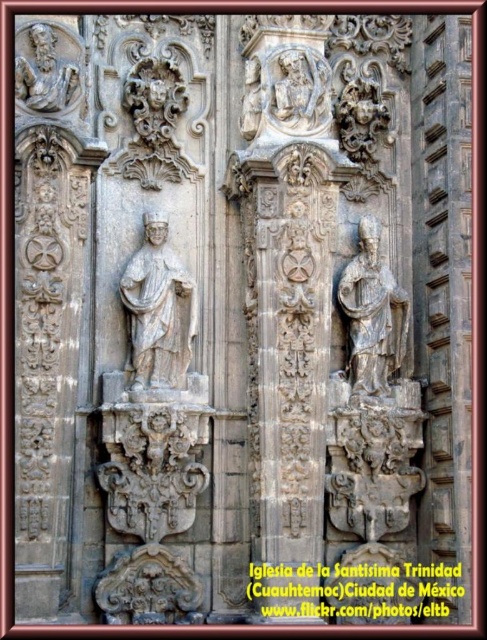
Is white stone statue at center positioned at the back of gray stone statue at center?

No.

The width and height of the screenshot is (487, 640). I want to click on white stone statue at center, so click(157, 308).

Does white stone statue at center appear over gray stone statue at upper left?

Actually, white stone statue at center is below gray stone statue at upper left.

At what (x,y) coordinates should I click in order to perform the action: click on white stone statue at center. Please return your answer as a coordinate pair (x, y). The width and height of the screenshot is (487, 640). Looking at the image, I should click on (157, 308).

Find the location of a particular element. The image size is (487, 640). white stone statue at center is located at coordinates (157, 308).

Can you confirm if gray stone statue at center is positioned below gray stone statue at upper left?

Indeed, gray stone statue at center is positioned under gray stone statue at upper left.

Between gray stone statue at center and gray stone statue at upper left, which one is positioned higher?

gray stone statue at upper left is above.

Identify the location of gray stone statue at center. The width and height of the screenshot is (487, 640). (372, 316).